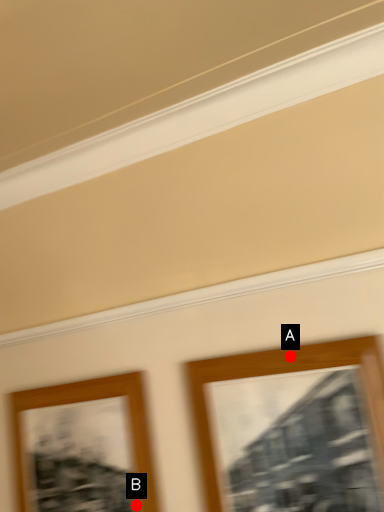
Question: Two points are circled on the image, labeled by A and B beside each circle. Which of the following is the closest to the observer?

Choices:
 (A) A is closer
 (B) B is closer

Answer: (A)